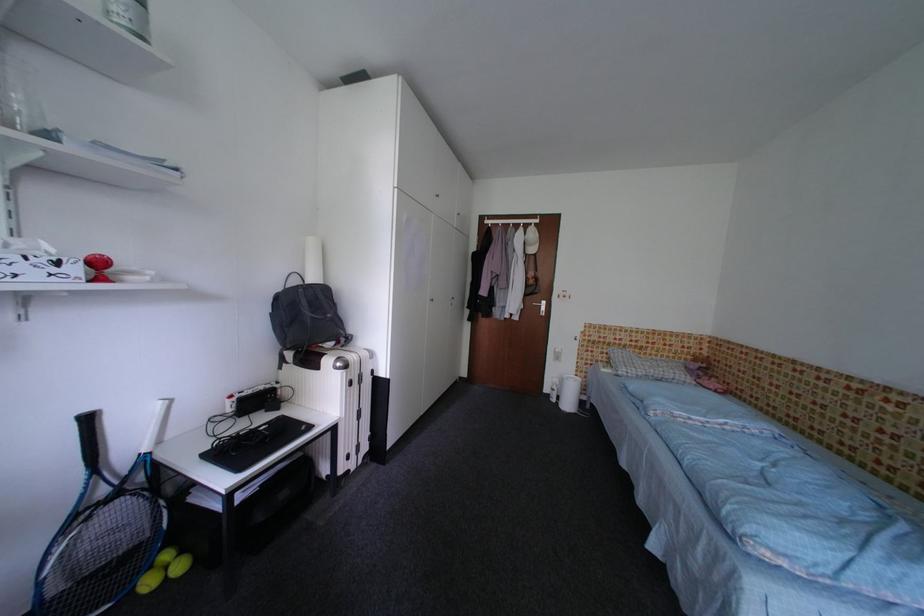
What are the coordinates of `silver door handle` in the screenshot? It's located at (537, 302).